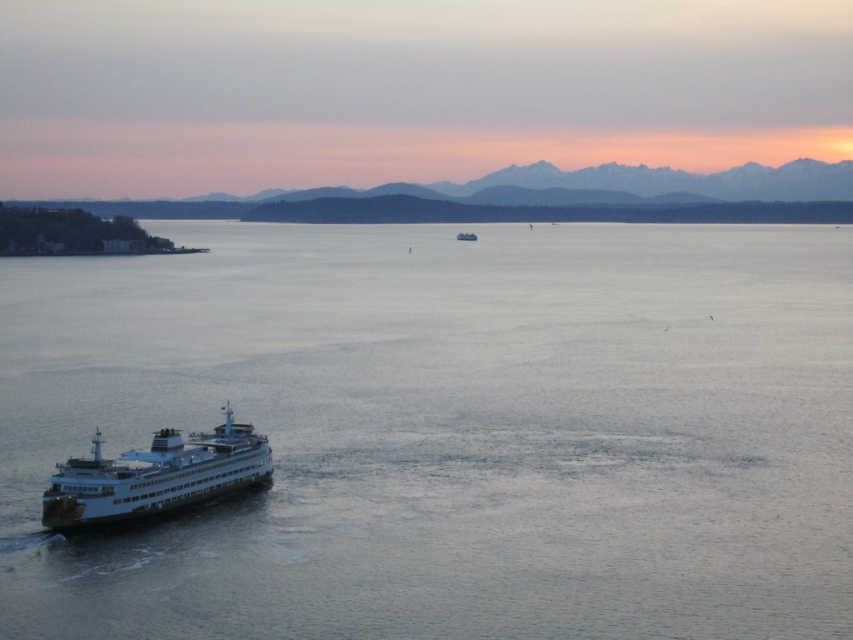
You are an observer looking at the serene maritime scene. You notice the clear water at center and the sandy brown mountains at upper center. Which of these two elements occupies a larger vertical space in the image?

The clear water at center has a greater height compared to the sandy brown mountains at upper center, so it occupies a larger vertical space in the image.

You are a sailor navigating a boat and want to reach the sandy brown mountains at upper center. Based on the scene, which direction should you steer your boat relative to the clear water at center?

You should steer your boat to the right relative to the clear water at center because the sandy brown mountains at upper center are located to the right of the clear water at center.